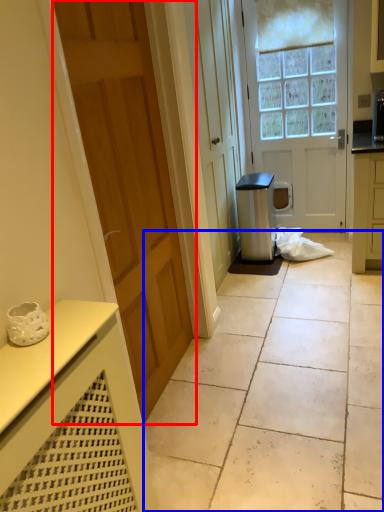
Question: Which of the following is the farthest to the observer, door (highlighted by a red box) or concrete (highlighted by a blue box)?

Choices:
 (A) door
 (B) concrete

Answer: (B)